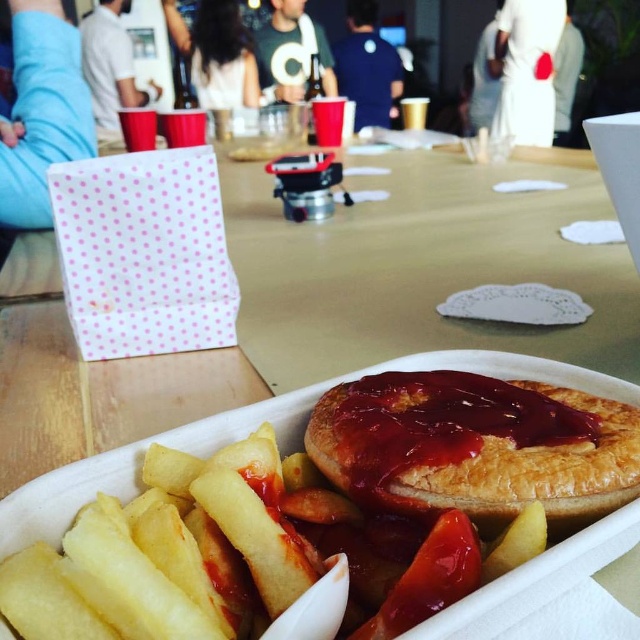
Does golden crispy french fries at lower left have a larger size compared to golden flaky pie at center?

No.

I want to click on golden crispy french fries at lower left, so click(x=163, y=554).

You are a GUI agent. You are given a task and a screenshot of the screen. Output one action in this format:
    pyautogui.click(x=<x>, y=<y>)
    Task: Click on the golden crispy french fries at lower left
    Image resolution: width=640 pixels, height=640 pixels.
    Given the screenshot: What is the action you would take?
    coord(163,554)